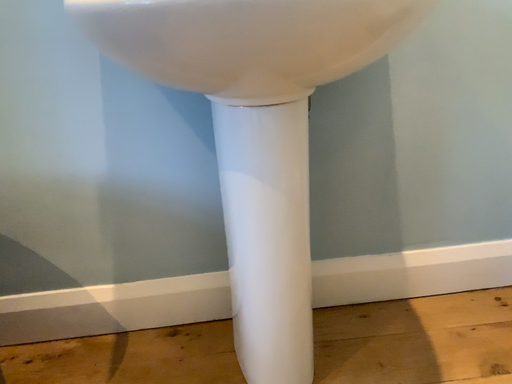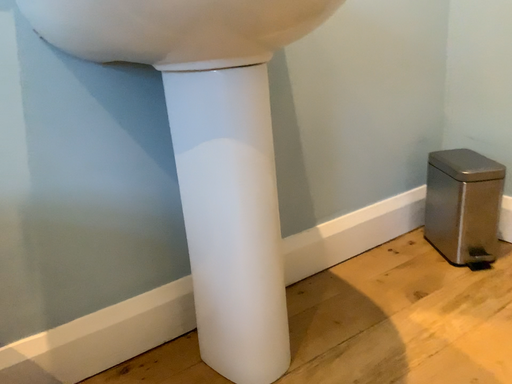
Question: Which way did the camera rotate in the video?

Choices:
 (A) rotated upward
 (B) rotated downward

Answer: (A)